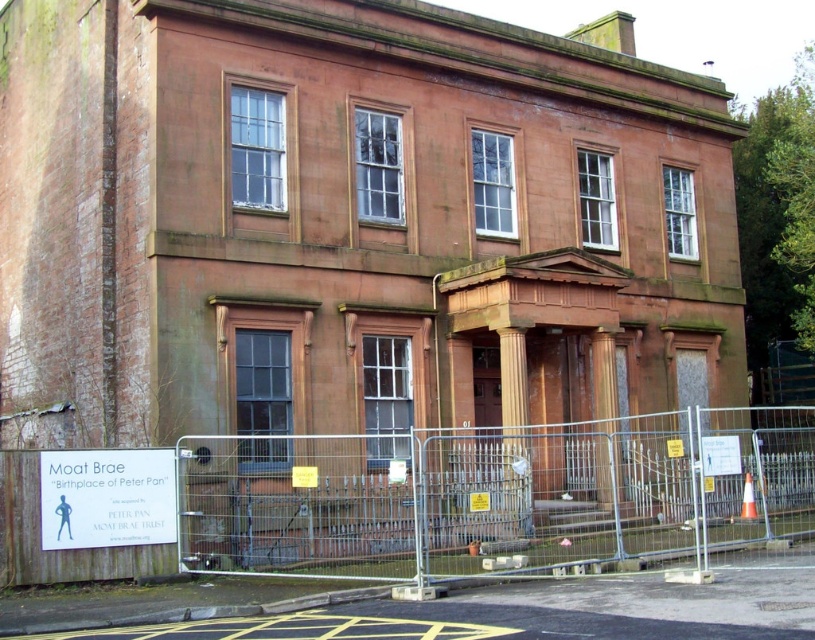
You are a delivery person trying to see the building entrance. The silver metallic fence at center and the white paper sign at lower left are in your way. Which one obstructs your view more?

The silver metallic fence at center is taller than the white paper sign at lower left, so it obstructs your view more.

Looking at this image, you are a delivery person trying to approach the entrance of the two story building. You see the silver metallic fence at center and the white paper sign at lower left. Which object is blocking your path to the entrance?

The silver metallic fence at center is blocking your path to the entrance because it is positioned in front of the white paper sign at lower left, which is closer to the entrance.